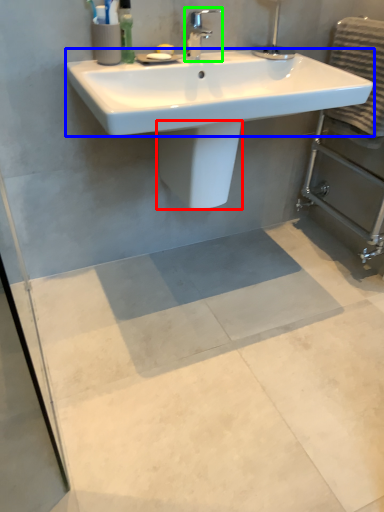
Question: Considering the real-world distances, which object is farthest from bidet (highlighted by a red box)? counter top (highlighted by a blue box) or tap (highlighted by a green box)?

Choices:
 (A) counter top
 (B) tap

Answer: (B)